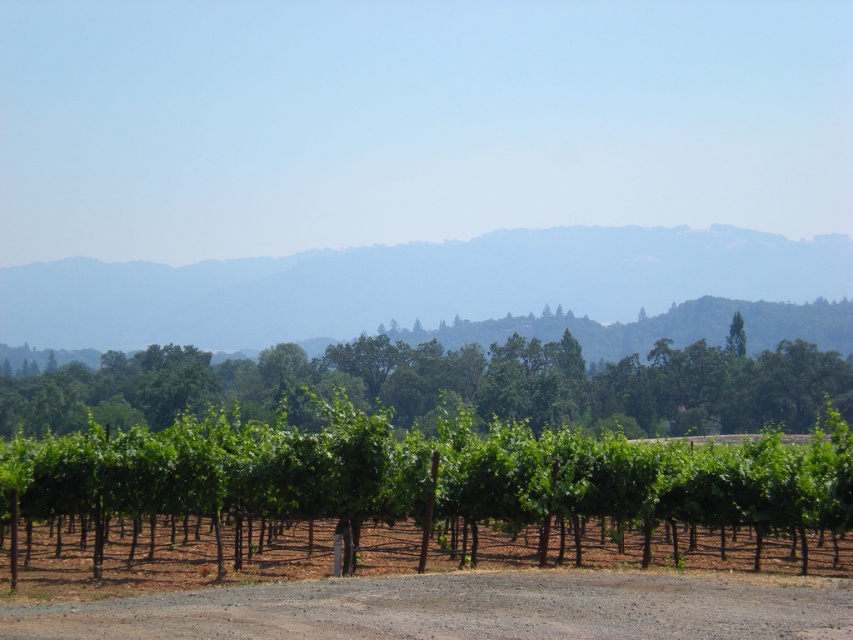
Question: Is green leafy vines at center smaller than brown gravel road at center?

Choices:
 (A) no
 (B) yes

Answer: (A)

Question: Does green leafy vines at center have a greater width compared to green forested mountain at upper center?

Choices:
 (A) yes
 (B) no

Answer: (B)

Question: Which of the following is the farthest from the observer?

Choices:
 (A) (166, 632)
 (B) (558, 269)
 (C) (735, 314)
 (D) (90, 424)

Answer: (B)

Question: Is green forested mountain at upper center positioned before brown gravel road at center?

Choices:
 (A) no
 (B) yes

Answer: (A)

Question: Which object appears closest to the camera in this image?

Choices:
 (A) green leafy tree at center
 (B) brown gravel road at center

Answer: (B)

Question: Which of the following is the farthest from the observer?

Choices:
 (A) coord(630,397)
 (B) coord(560,509)
 (C) coord(402,632)

Answer: (A)